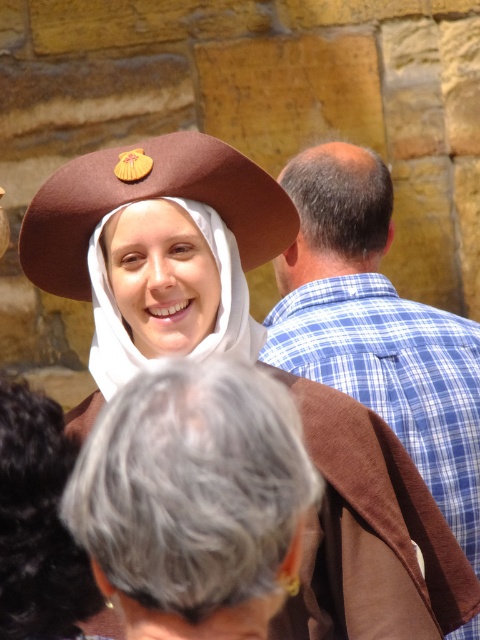
Based on the scene description, where is the brown hair at center located in the image?

The brown hair at center is located at the 2D coordinates point (336, 212) in the image.